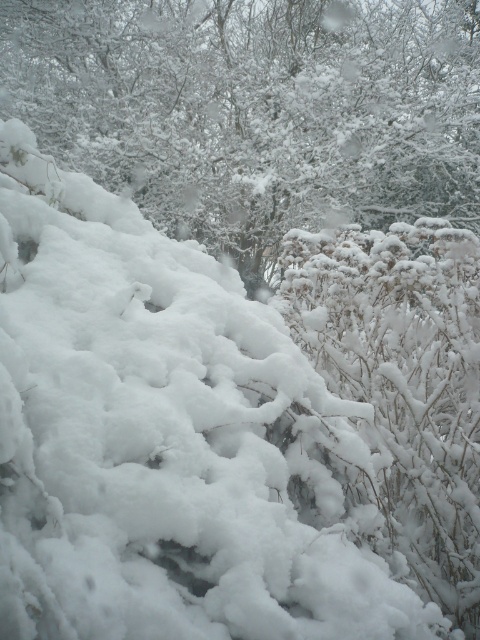
Question: Does white fluffy snow at center have a larger size compared to white fluffy bush at center?

Choices:
 (A) no
 (B) yes

Answer: (B)

Question: Does white fluffy snow at center appear over white fluffy bush at center?

Choices:
 (A) yes
 (B) no

Answer: (A)

Question: Which point appears closest to the camera in this image?

Choices:
 (A) (342, 340)
 (B) (229, 237)

Answer: (A)

Question: Among these points, which one is nearest to the camera?

Choices:
 (A) (133, 184)
 (B) (317, 321)

Answer: (B)

Question: Does white fluffy snow at center come behind white fluffy bush at center?

Choices:
 (A) no
 (B) yes

Answer: (B)

Question: Which object appears farthest from the camera in this image?

Choices:
 (A) white fluffy bush at center
 (B) white fluffy snow at center

Answer: (B)